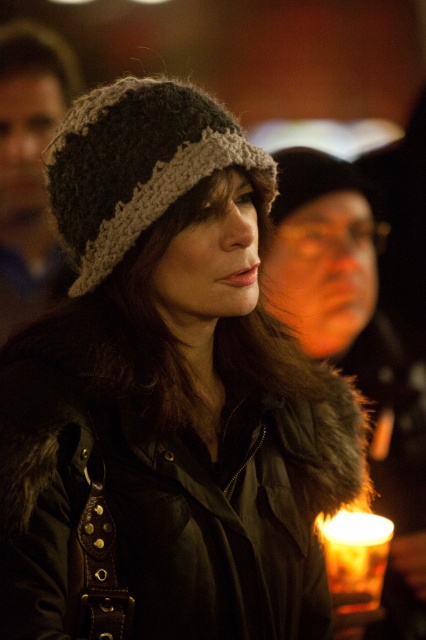
You are taking a photo of the knitted woolen hat at center and the translucent glass candle at lower right. Which object will appear larger in the photo?

The knitted woolen hat at center will appear larger in the photo because it is closer to the viewer than the translucent glass candle at lower right.

You are a photographer setting up a portrait session. You have a translucent glass candle at lower right and a fuzzy knit hat at center in your frame. Based on their sizes in the image, which object would you adjust to ensure both are equally prominent? Explain your reasoning.

The translucent glass candle at lower right occupies less space than the fuzzy knit hat at center. To make them equally prominent, you should enlarge the translucent glass candle at lower right or reduce the size of the fuzzy knit hat at center in the frame.